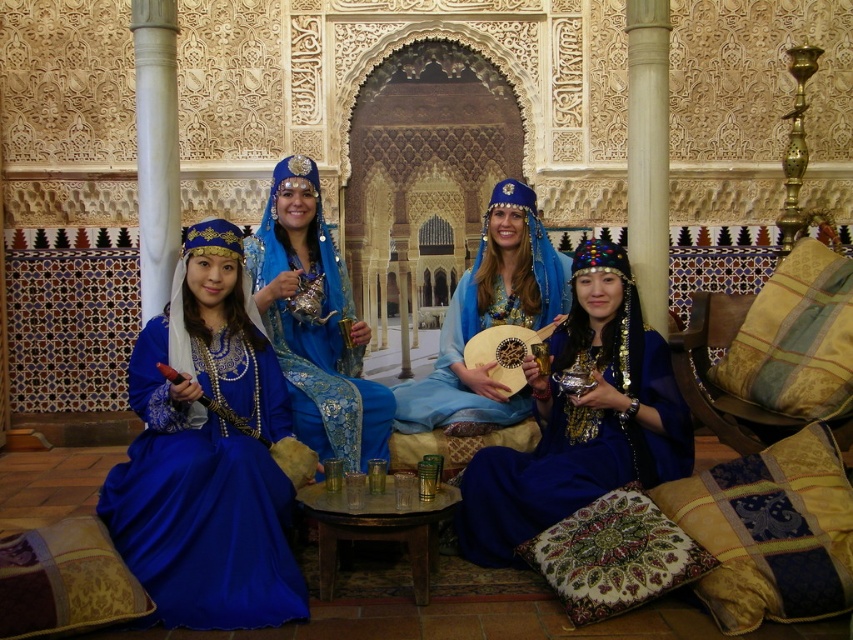
Who is positioned more to the left, satin blue dress at left or satin blue dress at center?

satin blue dress at left is more to the left.

Is satin blue dress at left smaller than satin blue dress at center?

Indeed, satin blue dress at left has a smaller size compared to satin blue dress at center.

Who is more distant from viewer, (152, 540) or (494, 195)?

Positioned behind is point (494, 195).

Image resolution: width=853 pixels, height=640 pixels. I want to click on satin blue dress at left, so click(206, 456).

Does shiny blue dress at center appear over matte blue dress at center?

No.

Who is more distant from viewer, (x=656, y=352) or (x=267, y=314)?

The point (x=267, y=314) is more distant.

Find the location of a particular element. shiny blue dress at center is located at coordinates (581, 419).

This screenshot has width=853, height=640. Describe the element at coordinates (581, 419) in the screenshot. I see `shiny blue dress at center` at that location.

Can you confirm if shiny blue dress at center is positioned above gold-patterned fabric pillow at right?

Actually, shiny blue dress at center is below gold-patterned fabric pillow at right.

Which is in front, point (538, 451) or point (762, 381)?

Point (762, 381) is in front.

The height and width of the screenshot is (640, 853). I want to click on shiny blue dress at center, so click(x=581, y=419).